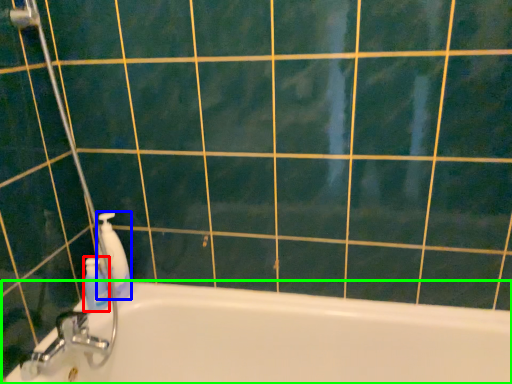
Question: Which object is positioned farthest from cleaning product (highlighted by a red box)? Select from cleaning product (highlighted by a blue box) and bathtub (highlighted by a green box).

Choices:
 (A) cleaning product
 (B) bathtub

Answer: (B)